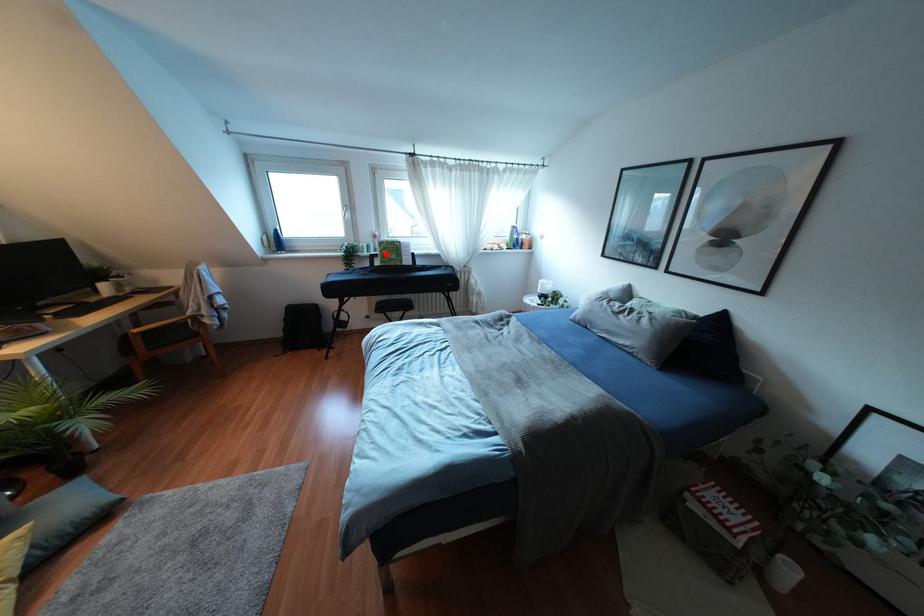
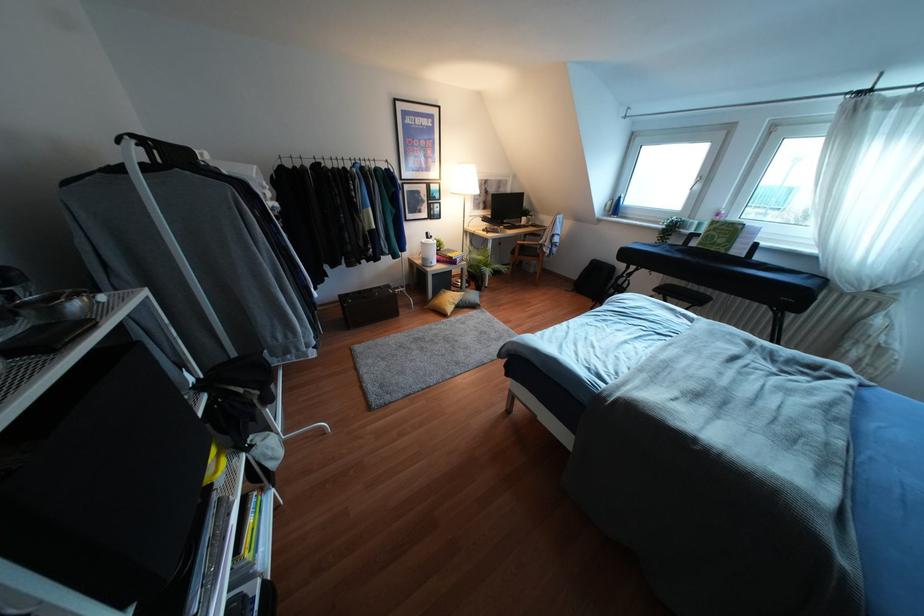
Where in the second image is the point corresponding to the highlighted location from the first image?

(712, 236)